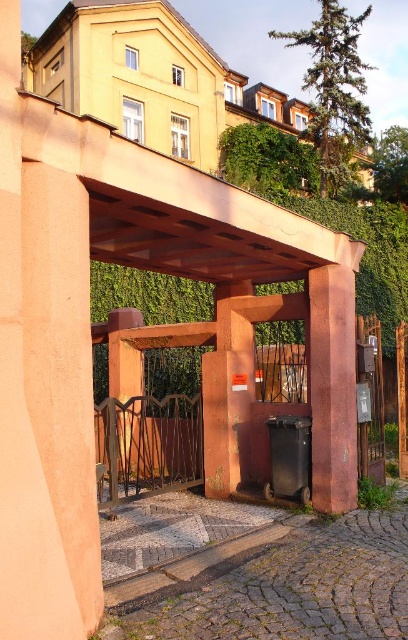
Question: Which of the following is the farthest from the observer?

Choices:
 (A) (117, 330)
 (B) (312, 275)

Answer: (A)

Question: Does rustic stone pillar at center have a smaller size compared to brown wood gate at center?

Choices:
 (A) no
 (B) yes

Answer: (B)

Question: Is rustic stone pillar at center thinner than brown wood gate at center?

Choices:
 (A) no
 (B) yes

Answer: (B)

Question: Among these points, which one is farthest from the camera?

Choices:
 (A) (323, 342)
 (B) (119, 371)

Answer: (B)

Question: Which of the following is the closest to the observer?

Choices:
 (A) rustic stone pillar at center
 (B) brown wood gate at center

Answer: (A)

Question: Is rustic stone pillar at center positioned at the back of brown wood gate at center?

Choices:
 (A) yes
 (B) no

Answer: (B)